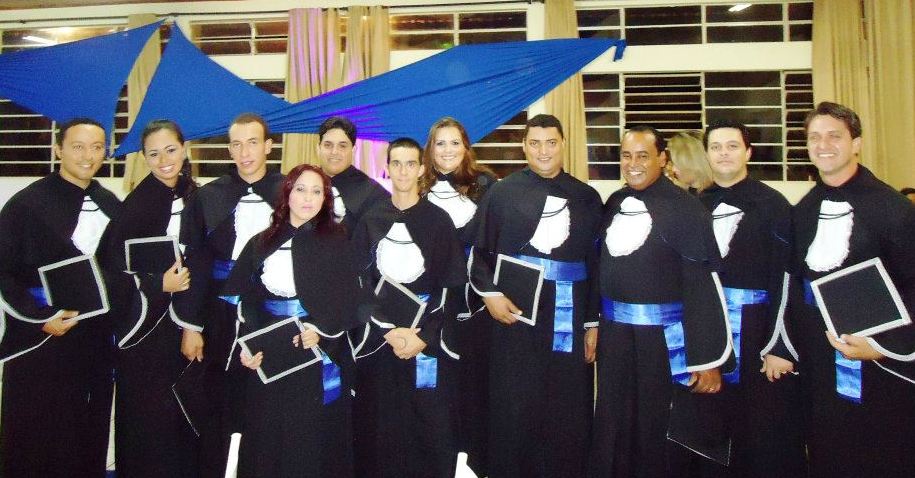
Locate an element on the screen. The height and width of the screenshot is (478, 915). robes is located at coordinates (58, 392).